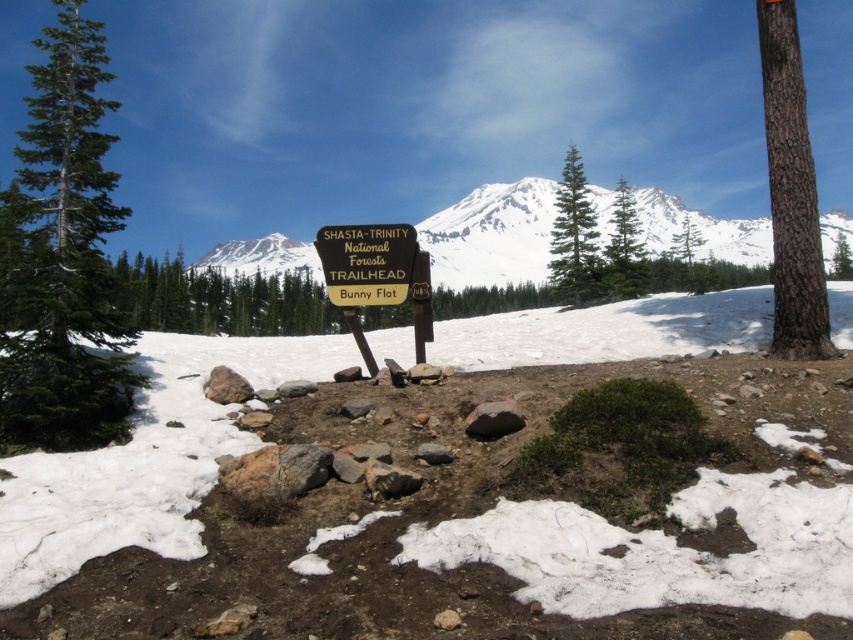
You are a hiker standing at the wooden signpost in the foreground of the mountain landscape. You want to take a photo of the brown rough bark tree at right and the green textured pine tree at upper center. Which tree should you focus on first if you want to capture both in your camera frame?

You should focus on the green textured pine tree at upper center first because the brown rough bark tree at right is to the left of it, meaning the pine tree is closer to the center of the scene and might be easier to frame with both trees in view.

You are standing at the base of the wooden signpost in the scene. Looking towards the green textured pine tree at center, what is its approximate 2D coordinate location on the image?

The green textured pine tree at center is located at the 2D coordinate point of approximately 0.392 in the x axis and 0.807 in the y axis.